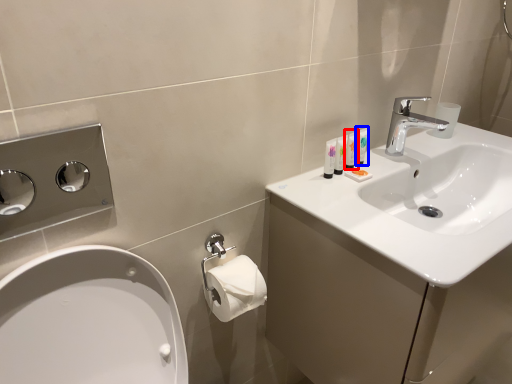
Question: Which of the following is the farthest to the observer, mouthwash (highlighted by a red box) or mouthwash (highlighted by a blue box)?

Choices:
 (A) mouthwash
 (B) mouthwash

Answer: (B)